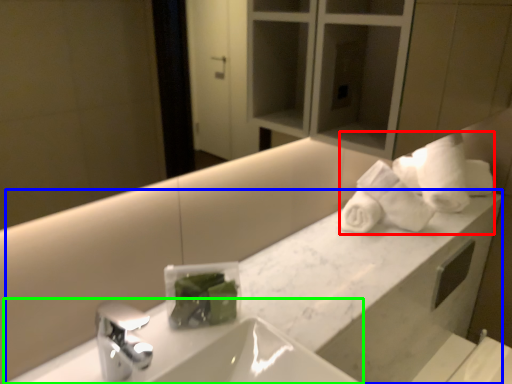
Question: Estimate the real-world distances between objects in this image. Which object is farther from bath towel (highlighted by a red box), counter (highlighted by a blue box) or sink (highlighted by a green box)?

Choices:
 (A) counter
 (B) sink

Answer: (B)